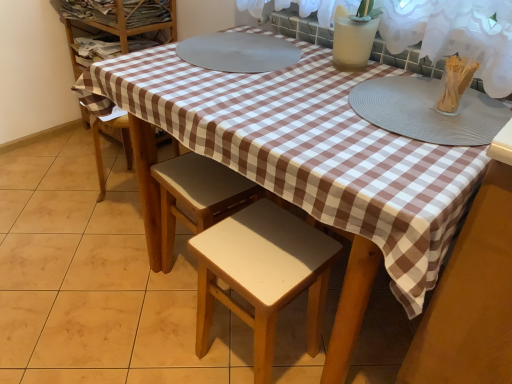
What do you see at coordinates (352, 40) in the screenshot? I see `white matte glass vase at upper right` at bounding box center [352, 40].

Measure the distance between point (x=461, y=89) and camera.

99.40 centimeters.

Describe the element at coordinates (428, 111) in the screenshot. The image size is (512, 384). I see `gray textured placemat at upper right` at that location.

Locate an element on the screen. The width and height of the screenshot is (512, 384). white matte glass vase at upper right is located at coordinates (352, 40).

Is clear plastic container at upper right wider or thinner than white matte stool at lower center, which ranks as the first stool in front-to-back order?

Considering their sizes, clear plastic container at upper right looks slimmer than white matte stool at lower center, which ranks as the first stool in front-to-back order.

From the image's perspective, is clear plastic container at upper right located above or below white matte stool at lower center, which ranks as the first stool in front-to-back order?

clear plastic container at upper right is situated higher than white matte stool at lower center, which ranks as the first stool in front-to-back order, in the image.

From a real-world perspective, is clear plastic container at upper right physically located above or below white matte stool at lower center, which ranks as the first stool in front-to-back order?

From a real-world perspective, clear plastic container at upper right is physically above white matte stool at lower center, which ranks as the first stool in front-to-back order.

Between clear plastic container at upper right and white matte stool at lower center, which ranks as the first stool in front-to-back order, which one has larger size?

white matte stool at lower center, which ranks as the first stool in front-to-back order.

Which is more to the right, gray textured placemat at upper right or white matte glass vase at upper right?

gray textured placemat at upper right is more to the right.

Looking at the image, does gray textured placemat at upper right seem bigger or smaller compared to white matte glass vase at upper right?

In the image, gray textured placemat at upper right appears to be larger than white matte glass vase at upper right.

Are gray textured placemat at upper right and white matte glass vase at upper right located far from each other?

No, gray textured placemat at upper right is in close proximity to white matte glass vase at upper right.

From the image's perspective, is gray textured placemat at upper right positioned above or below white matte glass vase at upper right?

gray textured placemat at upper right is below white matte glass vase at upper right.

Is the position of clear plastic container at upper right less distant than that of light brown wood stool at center, which ranks as the 1th stool in back-to-front order?

Yes, clear plastic container at upper right is in front of light brown wood stool at center, which ranks as the 1th stool in back-to-front order.

Can you confirm if clear plastic container at upper right is shorter than light brown wood stool at center, which ranks as the 1th stool in back-to-front order?

Yes.

In the scene shown: Which object is wider, clear plastic container at upper right or light brown wood stool at center, which ranks as the 1th stool in back-to-front order?

With larger width is light brown wood stool at center, which ranks as the 1th stool in back-to-front order.

Is clear plastic container at upper right far away from light brown wood stool at center, which ranks as the 1th stool in back-to-front order?

clear plastic container at upper right is near light brown wood stool at center, which ranks as the 1th stool in back-to-front order, not far away.

Would you say clear plastic container at upper right is inside or outside gray textured placemat at upper right?

clear plastic container at upper right exists outside the volume of gray textured placemat at upper right.

Could you tell me if clear plastic container at upper right is facing gray textured placemat at upper right?

No, clear plastic container at upper right is not aimed at gray textured placemat at upper right.

Can you confirm if clear plastic container at upper right is thinner than gray textured placemat at upper right?

Correct, the width of clear plastic container at upper right is less than that of gray textured placemat at upper right.

Is clear plastic container at upper right beside gray textured placemat at upper right?

Indeed, clear plastic container at upper right and gray textured placemat at upper right are beside each other and touching.

Looking at this image, is white matte stool at lower center, which ranks as the first stool in front-to-back order, oriented away from light brown wood stool at center, which ranks as the 1th stool in back-to-front order?

That's not correct — white matte stool at lower center, which ranks as the first stool in front-to-back order, is not looking away from light brown wood stool at center, which ranks as the 1th stool in back-to-front order.

From a real-world perspective, does white matte stool at lower center, which ranks as the first stool in front-to-back order, stand above light brown wood stool at center, which ranks as the 1th stool in back-to-front order?

Yes, from a real-world perspective, white matte stool at lower center, which ranks as the first stool in front-to-back order, is over light brown wood stool at center, which ranks as the 1th stool in back-to-front order

Does white matte stool at lower center, which ranks as the first stool in front-to-back order, come in front of light brown wood stool at center, which ranks as the 1th stool in back-to-front order?

Yes, white matte stool at lower center, which ranks as the first stool in front-to-back order, is closer to the camera.

Is point (197, 320) more distant than point (334, 46)?

Yes, it is behind point (334, 46).

Is white matte stool at lower center, positioned as the 2th stool in back-to-front order, surrounding white matte glass vase at upper right?

No, white matte stool at lower center, positioned as the 2th stool in back-to-front order, does not contain white matte glass vase at upper right.

Is white matte stool at lower center, which ranks as the first stool in front-to-back order, positioned far away from white matte glass vase at upper right?

That's not correct — white matte stool at lower center, which ranks as the first stool in front-to-back order, is a little close to white matte glass vase at upper right.

Considering the relative sizes of white matte stool at lower center, which ranks as the first stool in front-to-back order, and white matte glass vase at upper right in the image provided, is white matte stool at lower center, which ranks as the first stool in front-to-back order, taller than white matte glass vase at upper right?

Correct, white matte stool at lower center, which ranks as the first stool in front-to-back order, is much taller as white matte glass vase at upper right.

From the image's perspective, does light brown wood stool at center, marked as the 2th stool in a front-to-back arrangement, appear higher than white matte stool at lower center, which ranks as the first stool in front-to-back order?

Yes.

Consider the image. Is light brown wood stool at center, which ranks as the 1th stool in back-to-front order, with white matte stool at lower center, positioned as the 2th stool in back-to-front order?

No, light brown wood stool at center, which ranks as the 1th stool in back-to-front order, is not making contact with white matte stool at lower center, positioned as the 2th stool in back-to-front order.

Considering the relative sizes of light brown wood stool at center, marked as the 2th stool in a front-to-back arrangement, and white matte stool at lower center, positioned as the 2th stool in back-to-front order, in the image provided, is light brown wood stool at center, marked as the 2th stool in a front-to-back arrangement, smaller than white matte stool at lower center, positioned as the 2th stool in back-to-front order,?

Yes, light brown wood stool at center, marked as the 2th stool in a front-to-back arrangement, is smaller than white matte stool at lower center, positioned as the 2th stool in back-to-front order.

Considering the relative sizes of light brown wood stool at center, marked as the 2th stool in a front-to-back arrangement, and white matte stool at lower center, positioned as the 2th stool in back-to-front order, in the image provided, is light brown wood stool at center, marked as the 2th stool in a front-to-back arrangement, wider than white matte stool at lower center, positioned as the 2th stool in back-to-front order,?

No.

Locate an element on the screen. This screenshot has width=512, height=384. the 1st stool to the left when counting from the clear plastic container at upper right is located at coordinates (262, 274).

Identify the location of platter on the right of white matte glass vase at upper right. (428, 111).

Which object lies further to the anchor point clear plastic container at upper right, white matte stool at lower center, which ranks as the first stool in front-to-back order, or gray textured placemat at upper right?

white matte stool at lower center, which ranks as the first stool in front-to-back order, lies further to clear plastic container at upper right than the other object.

When comparing their distances from light brown wood stool at center, which ranks as the 1th stool in back-to-front order, does gray textured placemat at upper right or white matte glass vase at upper right seem closer?

Among the two, gray textured placemat at upper right is located nearer to light brown wood stool at center, which ranks as the 1th stool in back-to-front order.

Consider the image. Which object lies nearer to the anchor point light brown wood stool at center, marked as the 2th stool in a front-to-back arrangement, white matte glass vase at upper right or gray textured placemat at upper right?

Based on the image, gray textured placemat at upper right appears to be nearer to light brown wood stool at center, marked as the 2th stool in a front-to-back arrangement.

Looking at the image, which one is located further to white matte stool at lower center, positioned as the 2th stool in back-to-front order, gray textured placemat at upper right or clear plastic container at upper right?

Based on the image, clear plastic container at upper right appears to be further to white matte stool at lower center, positioned as the 2th stool in back-to-front order.

Based on their spatial positions, is white matte stool at lower center, which ranks as the first stool in front-to-back order, or gray textured placemat at upper right closer to white matte glass vase at upper right?

gray textured placemat at upper right is closer to white matte glass vase at upper right.

When comparing their distances from white matte stool at lower center, which ranks as the first stool in front-to-back order, does light brown wood stool at center, which ranks as the 1th stool in back-to-front order, or clear plastic container at upper right seem closer?

light brown wood stool at center, which ranks as the 1th stool in back-to-front order, is positioned closer to the anchor white matte stool at lower center, which ranks as the first stool in front-to-back order.

From the image, which object appears to be farther from light brown wood stool at center, marked as the 2th stool in a front-to-back arrangement, gray textured placemat at upper right or clear plastic container at upper right?

clear plastic container at upper right lies further to light brown wood stool at center, marked as the 2th stool in a front-to-back arrangement, than the other object.

Looking at the image, which one is located further to gray textured placemat at upper right, clear plastic container at upper right or light brown wood stool at center, marked as the 2th stool in a front-to-back arrangement?

light brown wood stool at center, marked as the 2th stool in a front-to-back arrangement, lies further to gray textured placemat at upper right than the other object.

This screenshot has width=512, height=384. Identify the location of platter between white matte glass vase at upper right and light brown wood stool at center, which ranks as the 1th stool in back-to-front order, from top to bottom. (428, 111).

Find the location of a particular element. The image size is (512, 384). glass vase between light brown wood stool at center, marked as the 2th stool in a front-to-back arrangement, and clear plastic container at upper right, in the horizontal direction is located at coordinates (352, 40).

I want to click on stool between white matte glass vase at upper right and white matte stool at lower center, positioned as the 2th stool in back-to-front order, from top to bottom, so click(198, 196).

Find the location of a particular element. The image size is (512, 384). stool between light brown wood stool at center, which ranks as the 1th stool in back-to-front order, and clear plastic container at upper right from left to right is located at coordinates (262, 274).